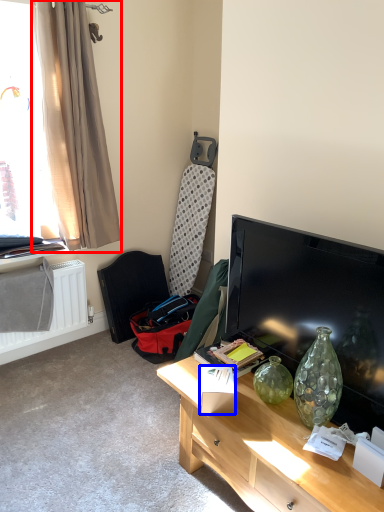
Question: Which of the following is the closest to the observer, curtain (highlighted by a red box) or box (highlighted by a blue box)?

Choices:
 (A) curtain
 (B) box

Answer: (B)